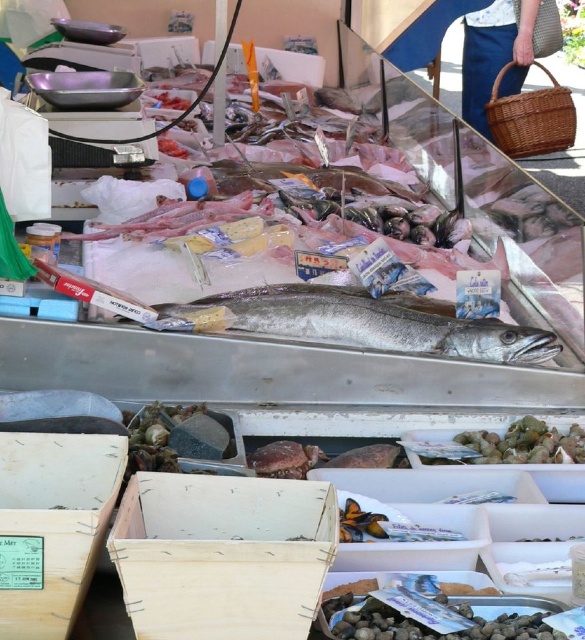
Question: Is silver/glossy fish at center thinner than woven brown basket at upper right?

Choices:
 (A) yes
 (B) no

Answer: (B)

Question: Is silver/glossy fish at center above woven brown basket at upper right?

Choices:
 (A) yes
 (B) no

Answer: (B)

Question: Can you confirm if silver/glossy fish at center is wider than woven brown basket at upper right?

Choices:
 (A) no
 (B) yes

Answer: (B)

Question: Which point is farther to the camera?

Choices:
 (A) woven brown basket at upper right
 (B) silver/glossy fish at center

Answer: (A)